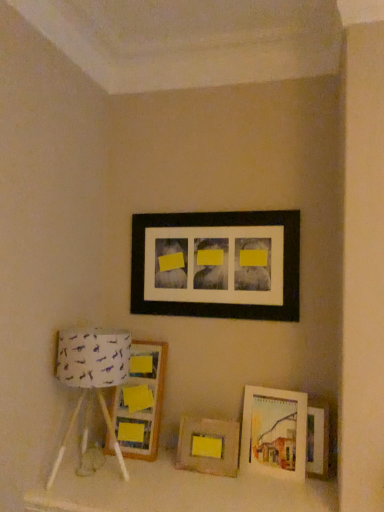
Question: Is matte wooden picture frame at lower right, acting as the third picture frame starting from the bottom, to the right of black matte picture frame at upper center, arranged as the fifth picture frame when ordered from the bottom, from the viewer's perspective?

Choices:
 (A) yes
 (B) no

Answer: (A)

Question: Considering the relative sizes of matte wooden picture frame at lower right, acting as the third picture frame starting from the bottom, and black matte picture frame at upper center, arranged as the fifth picture frame when ordered from the bottom, in the image provided, is matte wooden picture frame at lower right, acting as the third picture frame starting from the bottom, bigger than black matte picture frame at upper center, arranged as the fifth picture frame when ordered from the bottom,?

Choices:
 (A) no
 (B) yes

Answer: (A)

Question: From the image's perspective, is matte wooden picture frame at lower right, which appears as the 3th picture frame when viewed from the top, below black matte picture frame at upper center, the first picture frame in the top-to-bottom sequence?

Choices:
 (A) no
 (B) yes

Answer: (B)

Question: Is matte wooden picture frame at lower right, which appears as the 3th picture frame when viewed from the top, smaller than black matte picture frame at upper center, arranged as the fifth picture frame when ordered from the bottom?

Choices:
 (A) yes
 (B) no

Answer: (A)

Question: Is matte wooden picture frame at lower right, which appears as the 3th picture frame when viewed from the top, in front of black matte picture frame at upper center, arranged as the fifth picture frame when ordered from the bottom?

Choices:
 (A) yes
 (B) no

Answer: (A)

Question: Relative to wooden picture frame at lower right, which ranks as the fourth picture frame in top-to-bottom order, is wooden frame at center, which appears as the 1th picture frame when ordered from the bottom, in front or behind?

Choices:
 (A) behind
 (B) front

Answer: (A)

Question: In terms of height, does wooden frame at center, which appears as the 1th picture frame when ordered from the bottom, look taller or shorter compared to wooden picture frame at lower right, which ranks as the fourth picture frame in top-to-bottom order?

Choices:
 (A) tall
 (B) short

Answer: (B)

Question: Looking at the image, does wooden frame at center, arranged as the 5th picture frame when viewed from the top, seem bigger or smaller compared to wooden picture frame at lower right, which ranks as the fourth picture frame in top-to-bottom order?

Choices:
 (A) small
 (B) big

Answer: (B)

Question: From a real-world perspective, is wooden frame at center, which appears as the 1th picture frame when ordered from the bottom, above or below wooden picture frame at lower right, which ranks as the fourth picture frame in top-to-bottom order?

Choices:
 (A) below
 (B) above

Answer: (A)

Question: From the image's perspective, is wooden frame at center, which appears as the 1th picture frame when ordered from the bottom, above or below black matte picture frame at upper center, the first picture frame in the top-to-bottom sequence?

Choices:
 (A) below
 (B) above

Answer: (A)

Question: Considering the positions of wooden frame at center, which appears as the 1th picture frame when ordered from the bottom, and black matte picture frame at upper center, arranged as the fifth picture frame when ordered from the bottom, in the image, is wooden frame at center, which appears as the 1th picture frame when ordered from the bottom, wider or thinner than black matte picture frame at upper center, arranged as the fifth picture frame when ordered from the bottom,?

Choices:
 (A) thin
 (B) wide

Answer: (B)

Question: Do you think wooden frame at center, which appears as the 1th picture frame when ordered from the bottom, is within black matte picture frame at upper center, the first picture frame in the top-to-bottom sequence, or outside of it?

Choices:
 (A) inside
 (B) outside

Answer: (B)

Question: Looking at the image, does wooden frame at center, arranged as the 5th picture frame when viewed from the top, seem bigger or smaller compared to black matte picture frame at upper center, the first picture frame in the top-to-bottom sequence?

Choices:
 (A) big
 (B) small

Answer: (B)

Question: In terms of height, does wooden frame at center, which appears as the 1th picture frame when ordered from the bottom, look taller or shorter compared to wooden picture frame at left, which is the second picture frame in top-to-bottom order?

Choices:
 (A) tall
 (B) short

Answer: (B)

Question: Choose the correct answer: Is wooden frame at center, which appears as the 1th picture frame when ordered from the bottom, inside wooden picture frame at left, which is the second picture frame in top-to-bottom order, or outside it?

Choices:
 (A) outside
 (B) inside

Answer: (A)